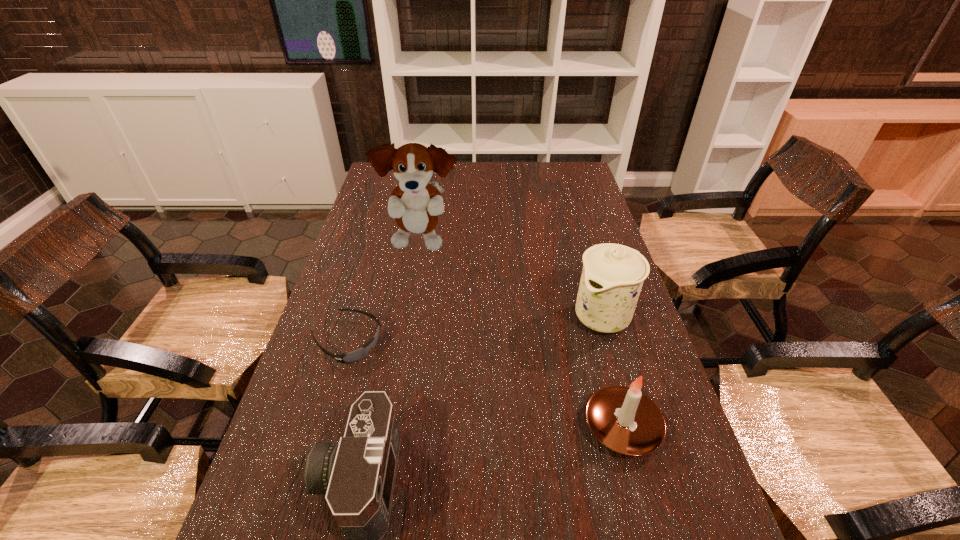
At what (x,y) coordinates should I click in order to perform the action: click on blank area located 0.130m on the lenses of the sunglasses. Please return your answer as a coordinate pair (x, y). Image resolution: width=960 pixels, height=540 pixels. Looking at the image, I should click on (412, 377).

Where is `free point located 0.370m on the lenses of the sunglasses`? free point located 0.370m on the lenses of the sunglasses is located at coordinates (495, 426).

This screenshot has width=960, height=540. I want to click on free space located 0.300m on the spout of the chinaware, so click(x=514, y=405).

You are a GUI agent. You are given a task and a screenshot of the screen. Output one action in this format:
    pyautogui.click(x=<x>, y=<y>)
    Task: Click on the free space located on the spout of the chinaware
    
    Given the screenshot: What is the action you would take?
    pyautogui.click(x=511, y=408)

Find the location of a particular element. This screenshot has width=960, height=540. free location located on the spout of the chinaware is located at coordinates (545, 374).

I want to click on puppy located in the left edge section of the desktop, so click(414, 203).

Locate an element on the screen. sunglasses that is at the left edge is located at coordinates (351, 357).

Locate an element on the screen. This screenshot has height=540, width=960. candle present at the right edge is located at coordinates (625, 420).

At what (x,y) coordinates should I click in order to perform the action: click on chinaware that is at the right edge. Please return your answer as a coordinate pair (x, y). Looking at the image, I should click on (612, 277).

This screenshot has width=960, height=540. Find the location of `free region at the far edge of the desktop`. free region at the far edge of the desktop is located at coordinates (473, 163).